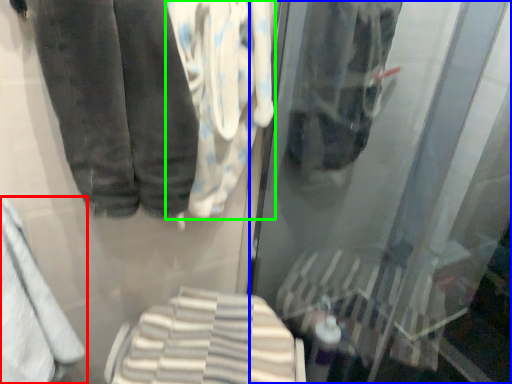
Question: Which object is the closest to the towel (highlighted by a red box)? Choose among these: shop window (highlighted by a blue box) or cloth (highlighted by a green box).

Choices:
 (A) shop window
 (B) cloth

Answer: (B)